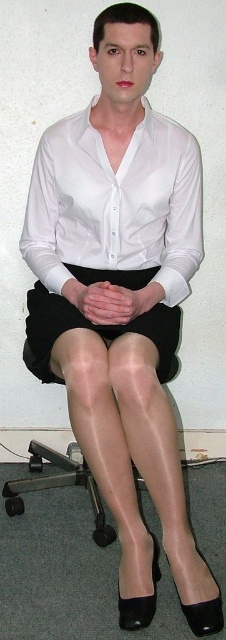
You are a fashion designer observing a model wearing a white satin shirt at center and black tights at center. Which clothing item is positioned to the right in the outfit?

The white satin shirt at center is positioned to the right of the black tights at center in the outfit.

You are a tailor who needs to determine which item has a greater horizontal spread when laid flat. Based on the scene, which object between the white satin shirt at center and the black tights at center is wider?

The white satin shirt at center is wider than the black tights at center.